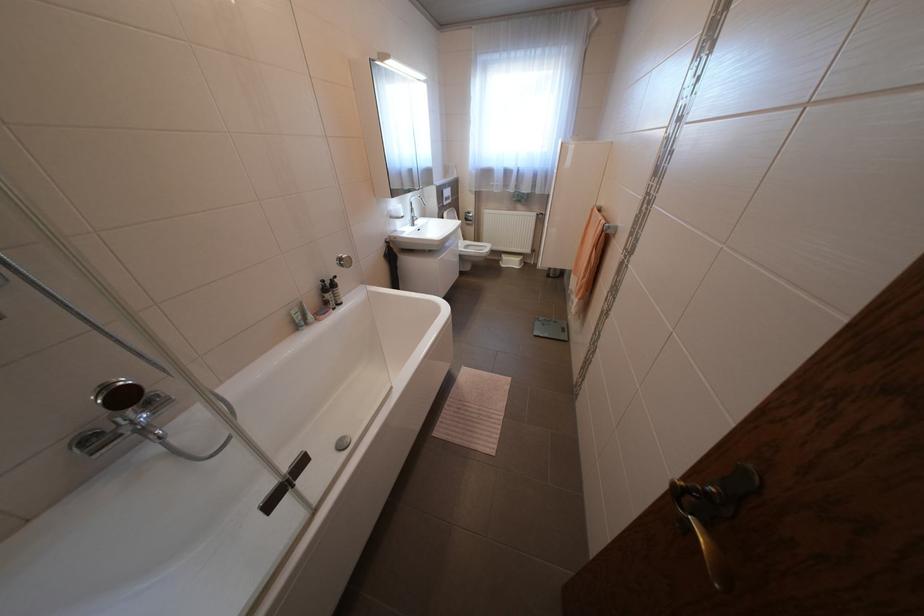
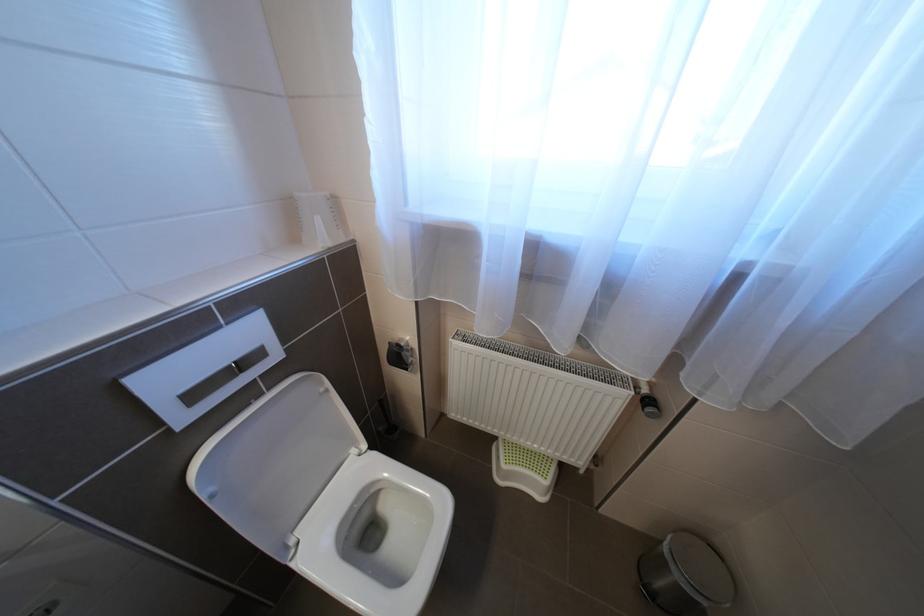
Question: Which direction would the cameraman need to move to produce the second image? Reply with the corresponding letter.

Choices:
 (A) Left
 (B) Right
 (C) Forward
 (D) Backward

Answer: (C)